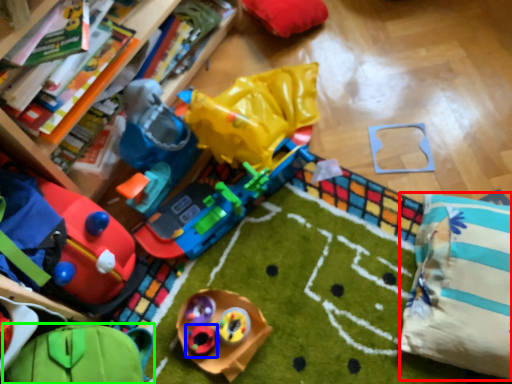
Question: Which object is positioned closest to pillow (highlighted by a red box)? Select from toy (highlighted by a blue box) and toy (highlighted by a green box).

Choices:
 (A) toy
 (B) toy

Answer: (A)